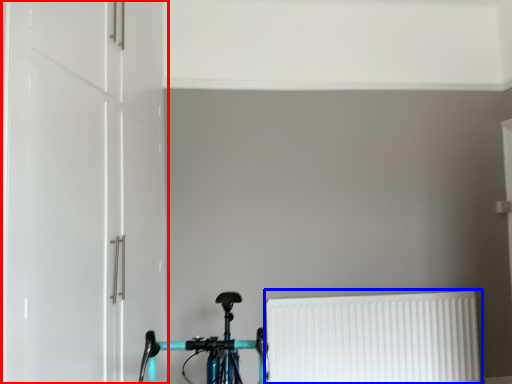
Question: Which object appears farthest to the camera in this image, door (highlighted by a red box) or radiator (highlighted by a blue box)?

Choices:
 (A) door
 (B) radiator

Answer: (B)